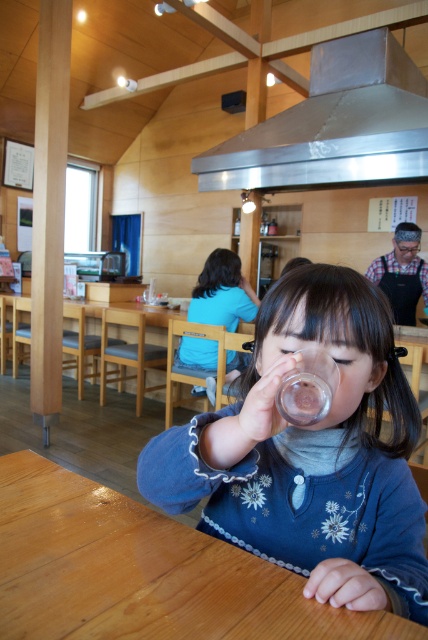
Question: Estimate the real-world distances between objects in this image. Which object is farther from the blue fabric sweater at center?

Choices:
 (A) wooden table at lower center
 (B) stainless steel exhaust hood at upper center

Answer: (B)

Question: Is blue fabric sweater at center bigger than wooden table at lower center?

Choices:
 (A) no
 (B) yes

Answer: (B)

Question: Can you confirm if wooden table at lower center is thinner than stainless steel exhaust hood at upper center?

Choices:
 (A) yes
 (B) no

Answer: (A)

Question: Is wooden table at lower center in front of blue fabric shirt at center?

Choices:
 (A) no
 (B) yes

Answer: (B)

Question: Which of the following is the farthest from the observer?

Choices:
 (A) (297, 582)
 (B) (371, 145)
 (C) (386, 332)
 (D) (208, 268)

Answer: (D)

Question: Which point appears closest to the camera in this image?

Choices:
 (A) (216, 472)
 (B) (256, 177)

Answer: (A)